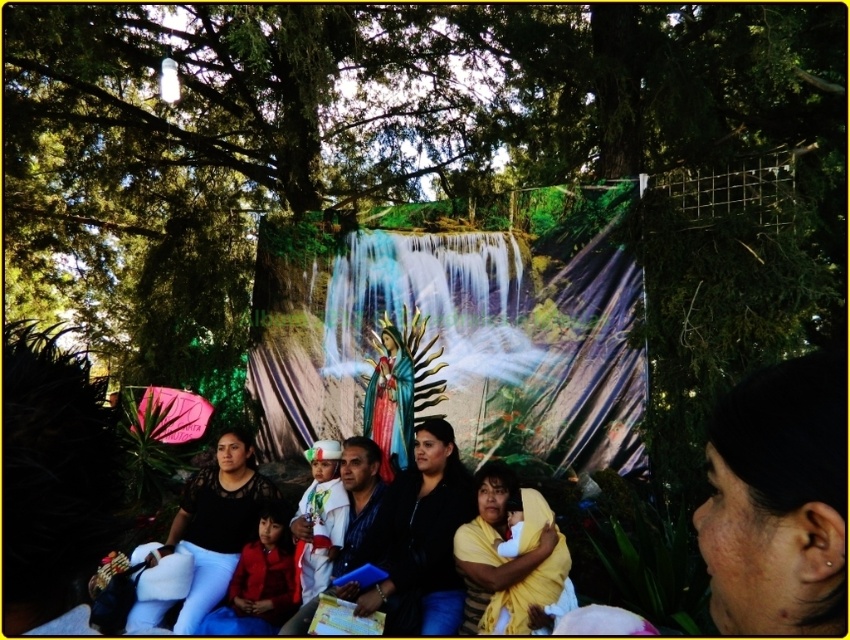
Question: Among these points, which one is farthest from the camera?

Choices:
 (A) (316, 566)
 (B) (537, 611)
 (C) (462, 580)

Answer: (A)

Question: Which of the following is the closest to the observer?

Choices:
 (A) (275, 624)
 (B) (442, 298)
 (C) (222, 568)

Answer: (A)

Question: Is black matte dress at center further to camera compared to white satin dress at center?

Choices:
 (A) yes
 (B) no

Answer: (B)

Question: Is white satin dress at center above yellow fabric baby at center?

Choices:
 (A) yes
 (B) no

Answer: (A)

Question: Which object appears closest to the camera in this image?

Choices:
 (A) black matte dress at center
 (B) white satin dress at center
 (C) matte black clothing at center

Answer: (C)

Question: Does red velvet dress at lower left have a smaller size compared to white satin dress at center?

Choices:
 (A) no
 (B) yes

Answer: (B)